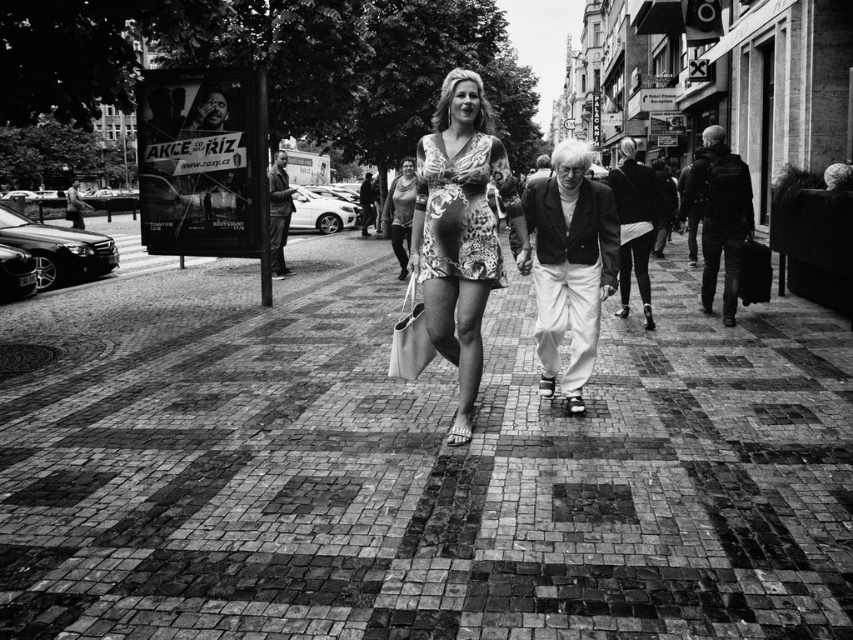
Question: Can you confirm if printed fabric dress at center is positioned to the left of matte beige fabric shopping bag at center?

Choices:
 (A) no
 (B) yes

Answer: (A)

Question: Among these points, which one is farthest from the camera?

Choices:
 (A) (676, 268)
 (B) (561, 333)
 (C) (412, 275)

Answer: (A)

Question: Can you confirm if brick pavement at center is smaller than printed fabric dress at center?

Choices:
 (A) no
 (B) yes

Answer: (A)

Question: Which of the following is the farthest from the observer?

Choices:
 (A) (415, 260)
 (B) (474, 156)
 (C) (410, 177)
 (D) (422, 330)

Answer: (C)

Question: Which object is positioned closest to the leopard print dress at center?

Choices:
 (A) printed fabric dress at center
 (B) matte beige fabric shopping bag at center
 (C) matte gray tank top at center
 (D) white cotton pants at center

Answer: (A)

Question: Can you confirm if white cotton pants at center is positioned above leopard print dress at center?

Choices:
 (A) no
 (B) yes

Answer: (B)